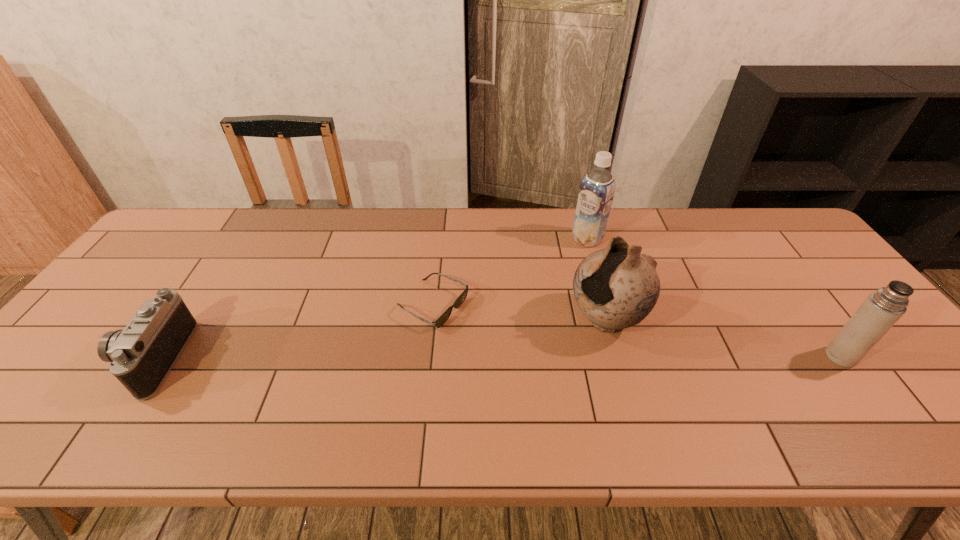
Where is `vacant space located 0.190m on the label of the farthest object`? This screenshot has height=540, width=960. vacant space located 0.190m on the label of the farthest object is located at coordinates (542, 278).

The height and width of the screenshot is (540, 960). I want to click on object located in the far edge section of the desktop, so click(x=596, y=193).

Where is `object located at the near edge`? Image resolution: width=960 pixels, height=540 pixels. object located at the near edge is located at coordinates (141, 356).

Find the location of a particular element. Image resolution: width=960 pixels, height=540 pixels. object that is positioned at the right edge is located at coordinates (883, 308).

Image resolution: width=960 pixels, height=540 pixels. Identify the location of free space at the far edge. (392, 228).

Find the location of a particular element. vacant region at the near edge of the desktop is located at coordinates (794, 382).

Image resolution: width=960 pixels, height=540 pixels. Identify the location of free space at the left edge of the desktop. (136, 288).

At what (x,y) coordinates should I click in order to perform the action: click on vacant space at the right edge. Please return your answer as a coordinate pair (x, y). The height and width of the screenshot is (540, 960). Looking at the image, I should click on (899, 351).

Where is `free space at the far left corner of the desktop`? The height and width of the screenshot is (540, 960). free space at the far left corner of the desktop is located at coordinates (189, 224).

Find the location of a particular element. vacant region at the near right corner of the desktop is located at coordinates (930, 392).